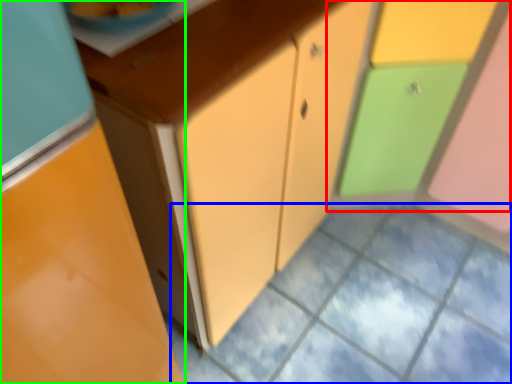
Question: Estimate the real-world distances between objects in this image. Which object is farther from cabinetry (highlighted by a red box), square (highlighted by a blue box) or cabinetry (highlighted by a green box)?

Choices:
 (A) square
 (B) cabinetry

Answer: (B)